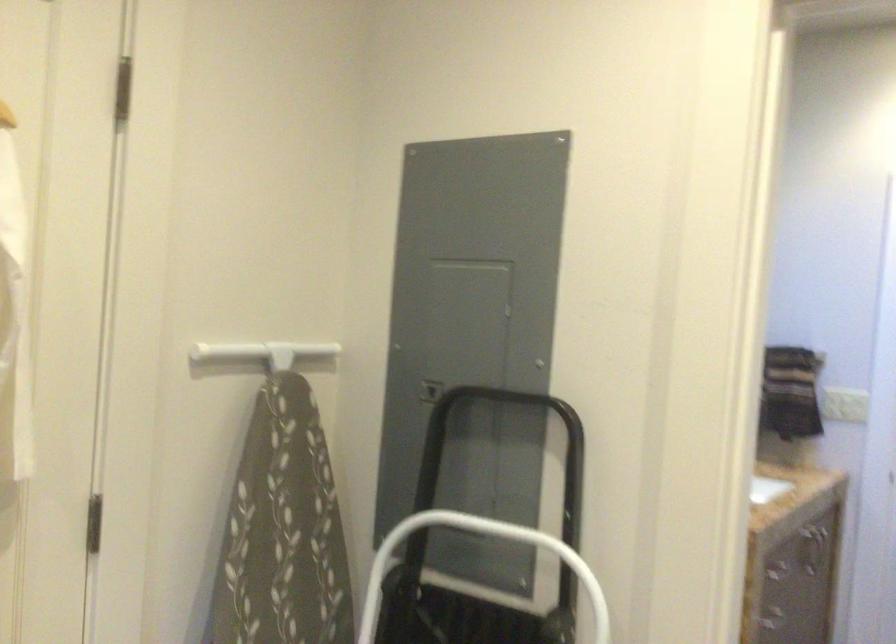
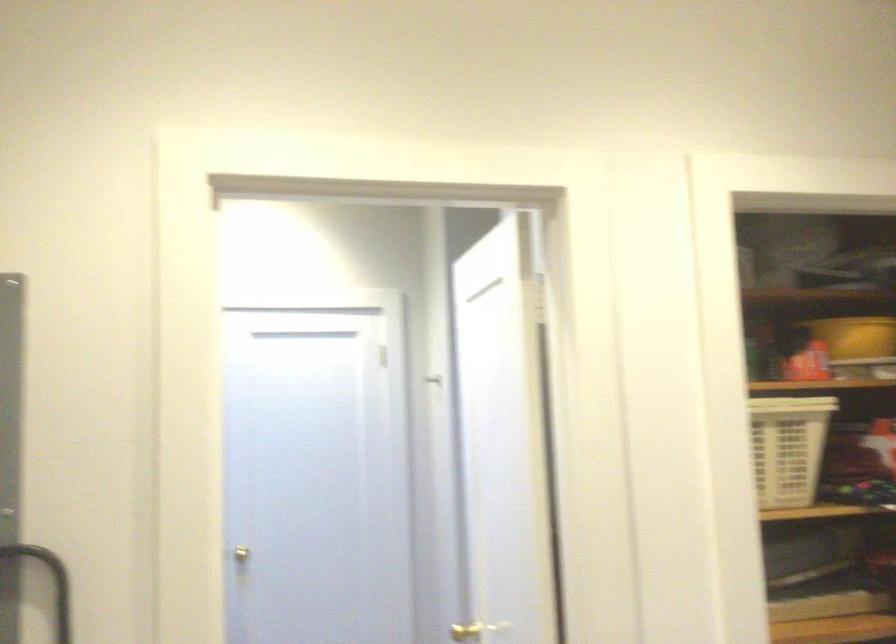
Question: The first image is from the beginning of the video and the second image is from the end. How did the camera likely rotate when shooting the video?

Choices:
 (A) Left
 (B) Right
 (C) Up
 (D) Down

Answer: (B)